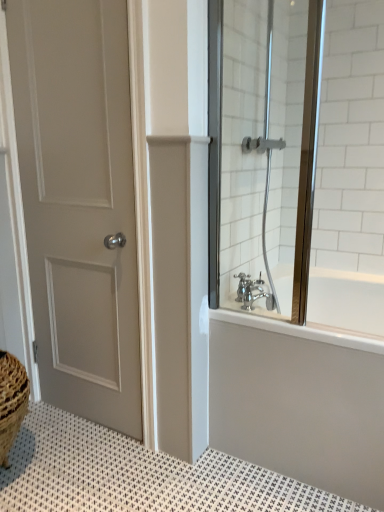
Question: Is matte gray door at left positioned beyond the bounds of clear glass shower door at right?

Choices:
 (A) yes
 (B) no

Answer: (A)

Question: Can you confirm if matte gray door at left is positioned to the left of clear glass shower door at right?

Choices:
 (A) yes
 (B) no

Answer: (A)

Question: Is the position of matte gray door at left less distant than that of clear glass shower door at right?

Choices:
 (A) no
 (B) yes

Answer: (A)

Question: Can you confirm if matte gray door at left is thinner than clear glass shower door at right?

Choices:
 (A) no
 (B) yes

Answer: (B)

Question: Does matte gray door at left have a smaller size compared to clear glass shower door at right?

Choices:
 (A) yes
 (B) no

Answer: (B)

Question: Considering the relative sizes of matte gray door at left and clear glass shower door at right in the image provided, is matte gray door at left shorter than clear glass shower door at right?

Choices:
 (A) no
 (B) yes

Answer: (A)

Question: Is clear glass shower door at right bigger than silver metallic faucet at lower right?

Choices:
 (A) yes
 (B) no

Answer: (A)

Question: Does clear glass shower door at right have a greater width compared to silver metallic faucet at lower right?

Choices:
 (A) no
 (B) yes

Answer: (B)

Question: Is clear glass shower door at right shorter than silver metallic faucet at lower right?

Choices:
 (A) yes
 (B) no

Answer: (B)

Question: Considering the relative positions of clear glass shower door at right and silver metallic faucet at lower right in the image provided, is clear glass shower door at right in front of silver metallic faucet at lower right?

Choices:
 (A) yes
 (B) no

Answer: (A)

Question: Is clear glass shower door at right looking in the opposite direction of silver metallic faucet at lower right?

Choices:
 (A) no
 (B) yes

Answer: (B)

Question: Can you confirm if clear glass shower door at right is positioned to the right of silver metallic faucet at lower right?

Choices:
 (A) no
 (B) yes

Answer: (A)

Question: Is silver metallic faucet at lower right facing away from white glossy bathtub at upper right?

Choices:
 (A) no
 (B) yes

Answer: (A)